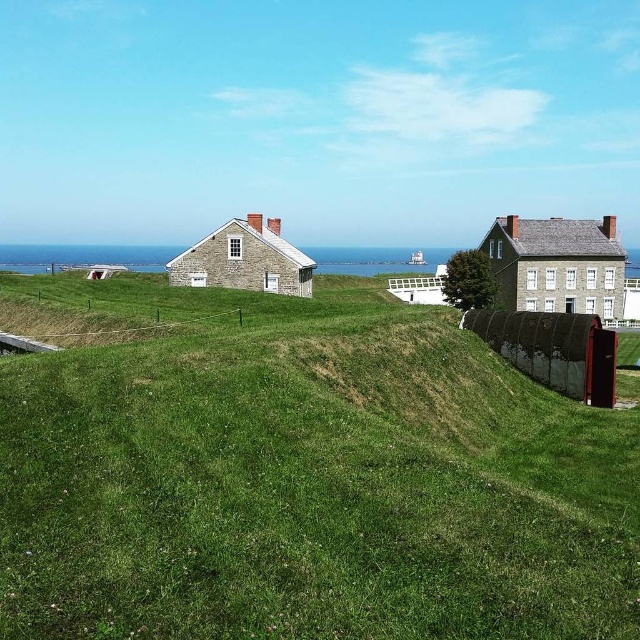
In the scene shown: Who is higher up, gray stone house at right or stone house at center?

gray stone house at right is higher up.

Does gray stone house at right have a larger size compared to stone house at center?

Correct, gray stone house at right is larger in size than stone house at center.

Where is `gray stone house at right`? The image size is (640, 640). gray stone house at right is located at coordinates (557, 264).

This screenshot has height=640, width=640. I want to click on gray stone house at right, so click(x=557, y=264).

Is green grassy hill at center taller than gray stone house at right?

No.

Between green grassy hill at center and gray stone house at right, which one is positioned lower?

green grassy hill at center is below.

Locate an element on the screen. The image size is (640, 640). green grassy hill at center is located at coordinates (300, 476).

This screenshot has height=640, width=640. Identify the location of green grassy hill at center. (300, 476).

Does green grassy hill at center appear on the right side of stone house at center?

Correct, you'll find green grassy hill at center to the right of stone house at center.

Does green grassy hill at center come behind stone house at center?

No, it is in front of stone house at center.

The height and width of the screenshot is (640, 640). I want to click on green grassy hill at center, so 300,476.

Locate an element on the screen. Image resolution: width=640 pixels, height=640 pixels. green grassy hill at center is located at coordinates (300, 476).